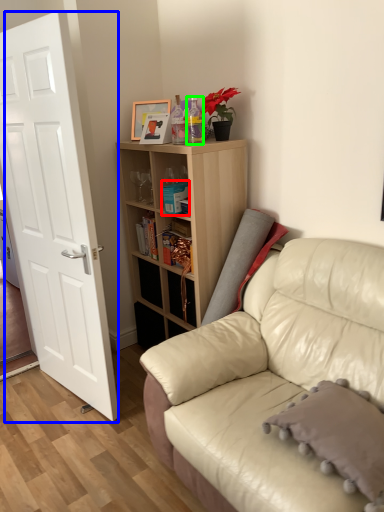
Question: Which object is the closest to the book (highlighted by a red box)? Choose among these: door (highlighted by a blue box) or bottle (highlighted by a green box).

Choices:
 (A) door
 (B) bottle

Answer: (B)